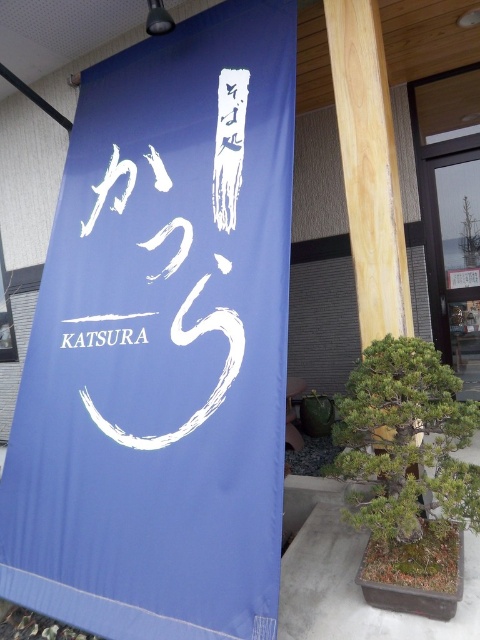
You are an interior designer planning to hang a new decoration in this space. The decoration is 1.2 meters wide. The blue fabric sign at center and the green leafy plant at lower right are already present. Which object can the new decoration be placed next to without overlapping, considering their sizes?

The blue fabric sign at center has a larger size compared to green leafy plant at lower right. Since the new decoration is 1.2 meters wide, it would be better placed next to the blue fabric sign at center as it likely has more space available due to its larger size.

You are standing in front of the entrance and need to place a new decorative item between the blue fabric sign at center and the green leafy plant at lower right. Where should you place it so it is between them?

The blue fabric sign at center is above the green leafy plant at lower right, so placing the new decorative item between them would require positioning it below the blue fabric sign at center and above the green leafy plant at lower right.